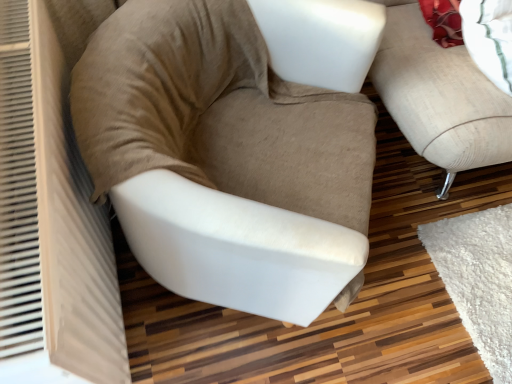
Measure the distance between beige fabric chair at center and camera.

A distance of 68.13 centimeters exists between beige fabric chair at center and camera.

Identify the location of beige fabric chair at center. (222, 159).

This screenshot has width=512, height=384. What do you see at coordinates (222, 159) in the screenshot?
I see `beige fabric chair at center` at bounding box center [222, 159].

In the scene shown: Measure the distance between point (378, 1) and camera.

Point (378, 1) is 39.09 inches from camera.

The width and height of the screenshot is (512, 384). What do you see at coordinates (440, 96) in the screenshot? I see `beige fabric studio couch at right` at bounding box center [440, 96].

This screenshot has width=512, height=384. What are the coordinates of `beige fabric studio couch at right` in the screenshot? It's located at (440, 96).

What is the approximate width of beige fabric studio couch at right?

beige fabric studio couch at right is 85.79 centimeters wide.

Measure the distance between beige fabric studio couch at right and camera.

beige fabric studio couch at right and camera are 3.64 feet apart from each other.

Identify the location of beige fabric chair at center. (222, 159).

Is beige fabric chair at center at the left side of beige fabric studio couch at right?

Correct, you'll find beige fabric chair at center to the left of beige fabric studio couch at right.

In the image, is beige fabric chair at center positioned in front of or behind beige fabric studio couch at right?

Clearly, beige fabric chair at center is in front of beige fabric studio couch at right.

Considering the positions of point (155, 164) and point (502, 102), is point (155, 164) closer or farther from the camera than point (502, 102)?

Point (155, 164) is positioned closer to the camera compared to point (502, 102).

From the image's perspective, which is below, beige fabric chair at center or beige fabric studio couch at right?

beige fabric chair at center, from the image's perspective.

From a real-world perspective, who is located lower, beige fabric chair at center or beige fabric studio couch at right?

From a 3D spatial view, beige fabric chair at center is below.

Looking at their sizes, would you say beige fabric chair at center is wider or thinner than beige fabric studio couch at right?

Considering their sizes, beige fabric chair at center looks slimmer than beige fabric studio couch at right.

Considering the sizes of beige fabric chair at center and beige fabric studio couch at right in the image, is beige fabric chair at center taller or shorter than beige fabric studio couch at right?

In the image, beige fabric chair at center appears to be shorter than beige fabric studio couch at right.

Looking at the image, does beige fabric chair at center seem bigger or smaller compared to beige fabric studio couch at right?

Considering their sizes, beige fabric chair at center takes up less space than beige fabric studio couch at right.

Based on the photo, is beige fabric chair at center positioned beyond the bounds of beige fabric studio couch at right?

Yes, beige fabric chair at center is outside of beige fabric studio couch at right.

Is beige fabric chair at center not near beige fabric studio couch at right?

They are positioned close to each other.

Based on the photo, is beige fabric chair at center aimed at beige fabric studio couch at right?

No, beige fabric chair at center is not oriented towards beige fabric studio couch at right.

The height and width of the screenshot is (384, 512). I want to click on chair in front of the beige fabric studio couch at right, so click(x=222, y=159).

Is beige fabric studio couch at right to the left or to the right of beige fabric chair at center in the image?

From the image, it's evident that beige fabric studio couch at right is to the right of beige fabric chair at center.

Between beige fabric studio couch at right and beige fabric chair at center, which one is positioned behind?

beige fabric studio couch at right is behind.

Is point (419, 125) positioned after point (237, 38)?

Yes, point (419, 125) is farther from viewer.

From the image's perspective, is beige fabric studio couch at right located above or below beige fabric chair at center?

Based on their image positions, beige fabric studio couch at right is located above beige fabric chair at center.

From a real-world perspective, which object stands above the other?

From a 3D spatial view, beige fabric studio couch at right is above.

Can you confirm if beige fabric studio couch at right is thinner than beige fabric chair at center?

No.

Considering the sizes of beige fabric studio couch at right and beige fabric chair at center in the image, is beige fabric studio couch at right taller or shorter than beige fabric chair at center?

In the image, beige fabric studio couch at right appears to be taller than beige fabric chair at center.

Based on the photo, in terms of size, does beige fabric studio couch at right appear bigger or smaller than beige fabric chair at center?

Clearly, beige fabric studio couch at right is larger in size than beige fabric chair at center.

Is beige fabric studio couch at right inside the boundaries of beige fabric chair at center, or outside?

beige fabric studio couch at right is not inside beige fabric chair at center, it's outside.

Is there a large distance between beige fabric studio couch at right and beige fabric chair at center?

No, beige fabric studio couch at right is not far from beige fabric chair at center.

Is beige fabric studio couch at right facing towards beige fabric chair at center?

No.

What's the angular difference between beige fabric studio couch at right and beige fabric chair at center's facing directions?

beige fabric studio couch at right and beige fabric chair at center are facing 62.3 degrees away from each other.

There is a beige fabric chair at center. Identify the location of studio couch above it (from a real-world perspective). [440, 96].

The height and width of the screenshot is (384, 512). I want to click on studio couch on the right of beige fabric chair at center, so click(440, 96).

This screenshot has height=384, width=512. I want to click on studio couch above the beige fabric chair at center (from the image's perspective), so click(440, 96).